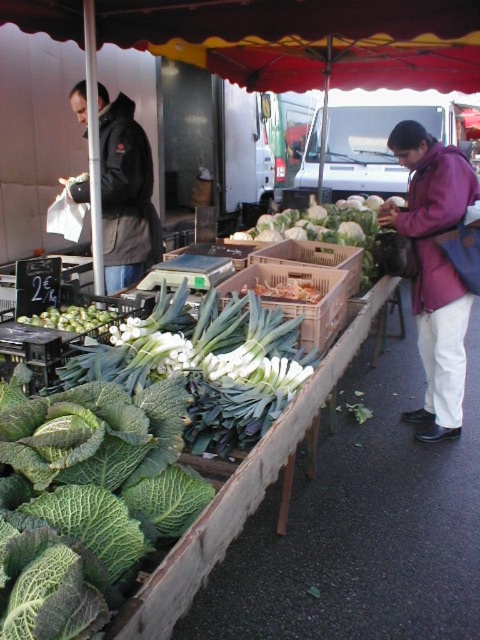
You are a customer at the market and want to buy the green leafy at center. You see the purple fleece jacket at right nearby. Which item is closer to your right hand if you are facing the stall?

The purple fleece jacket at right is positioned on the right side of green leafy at center, so it is closer to your right hand when facing the stall.